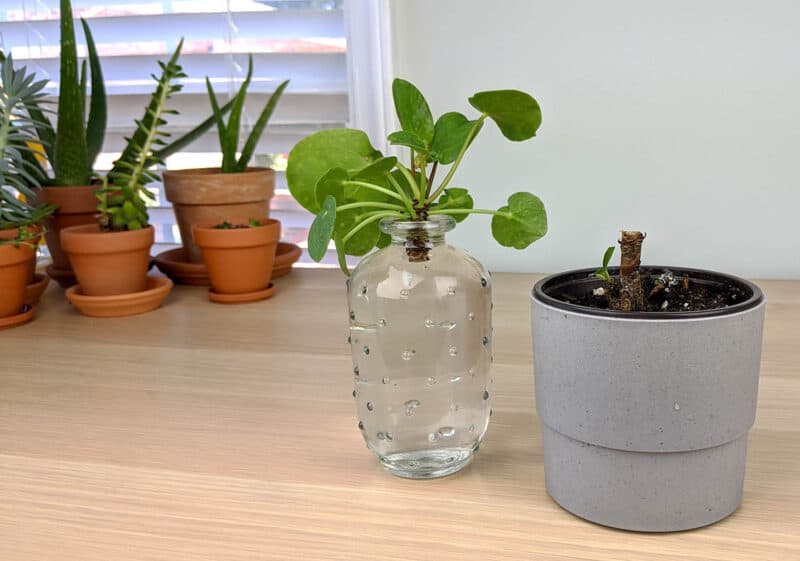
Locate an element on the screen. window blind is located at coordinates (289, 32).